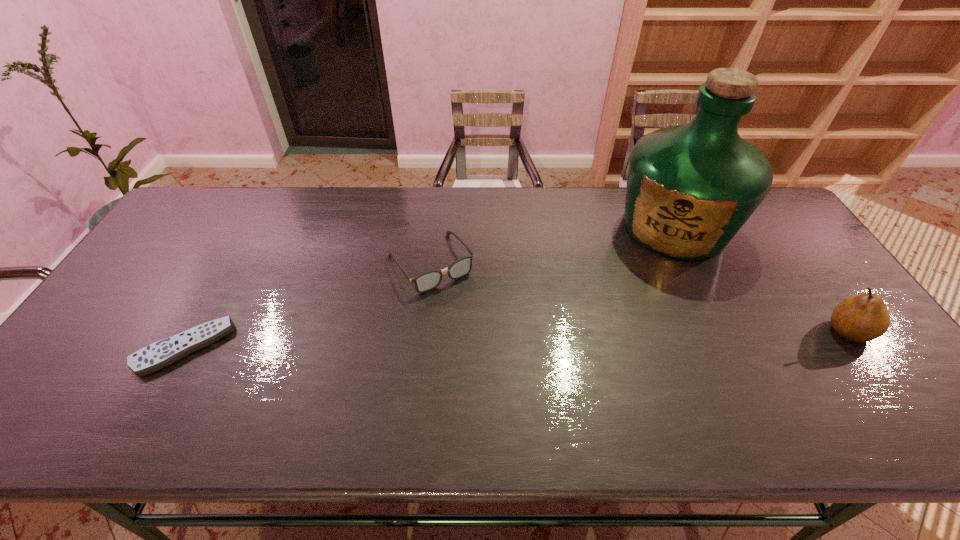
Image resolution: width=960 pixels, height=540 pixels. I want to click on remote control, so click(162, 353).

Identify the location of the shortest object. (162, 353).

Locate an element on the screen. Image resolution: width=960 pixels, height=540 pixels. pear is located at coordinates (864, 317).

This screenshot has width=960, height=540. What are the coordinates of `the rightmost object` in the screenshot? It's located at (864, 317).

What are the coordinates of `the second shortest object` in the screenshot? It's located at (429, 280).

Find the location of a particular element. Image resolution: width=960 pixels, height=540 pixels. spectacles is located at coordinates 429,280.

Where is `liquor`? The height and width of the screenshot is (540, 960). liquor is located at coordinates (690, 188).

The height and width of the screenshot is (540, 960). What are the coordinates of `the second object from right to left` in the screenshot? It's located at (690, 188).

This screenshot has height=540, width=960. I want to click on vacant area situated 0.080m on the left of the shortest object, so click(x=109, y=347).

Locate an element on the screen. vacant region located on the left of the pear is located at coordinates [685, 331].